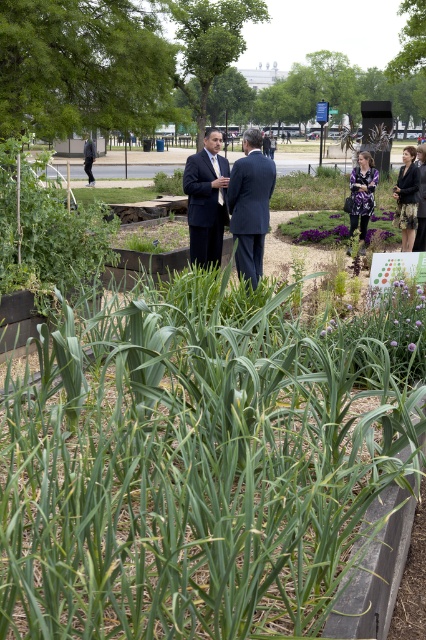
Does green leafy plant at left come in front of matte black suit at center?

Yes.

Between green leafy plant at left and matte black suit at center, which one is positioned higher?

matte black suit at center is above.

At what (x,y) coordinates should I click in order to perform the action: click on green leafy plant at left. Please return your answer as a coordinate pair (x, y). The width and height of the screenshot is (426, 640). Looking at the image, I should click on (46, 230).

This screenshot has width=426, height=640. I want to click on green leafy plant at left, so point(46,230).

Can you confirm if dark purple dress at right is smaller than purple floral dress at center?

Correct, dark purple dress at right occupies less space than purple floral dress at center.

Does dark purple dress at right have a lesser width compared to purple floral dress at center?

Yes, dark purple dress at right is thinner than purple floral dress at center.

The height and width of the screenshot is (640, 426). Identify the location of dark purple dress at right. (406, 196).

Find the location of a particular element. dark purple dress at right is located at coordinates (406, 196).

The height and width of the screenshot is (640, 426). What do you see at coordinates (207, 198) in the screenshot?
I see `matte black suit at center` at bounding box center [207, 198].

Based on the photo, between matte black suit at center and purple floral dress at center, which one is positioned higher?

purple floral dress at center

Is point (219, 202) positioned before point (367, 224)?

Yes.

The height and width of the screenshot is (640, 426). I want to click on matte black suit at center, so click(x=207, y=198).